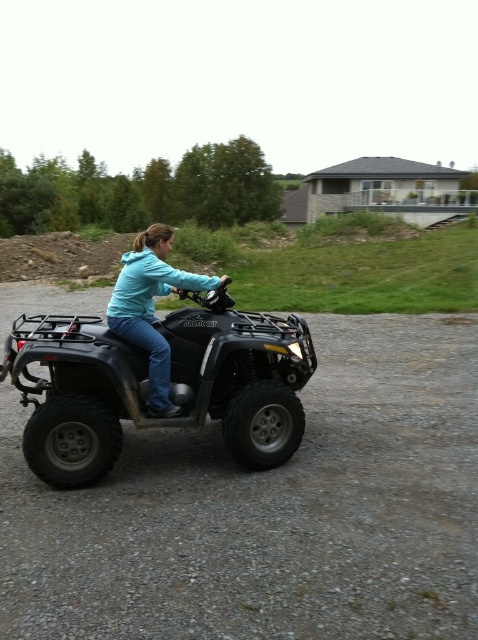
This screenshot has width=478, height=640. Find the location of `black rubber dirt track at center`. black rubber dirt track at center is located at coordinates (270, 509).

In the scene shown: Who is higher up, black rubber dirt track at center or matte black atv at center?

matte black atv at center is above.

Measure the distance between black rubber dirt track at center and camera.

A distance of 5.54 meters exists between black rubber dirt track at center and camera.

Where is `black rubber dirt track at center`? The image size is (478, 640). black rubber dirt track at center is located at coordinates (270, 509).

Which is behind, point (99, 428) or point (159, 332)?

Positioned behind is point (159, 332).

Which of these two, matte black atv at center or teal matte jacket at center, stands shorter?

With less height is matte black atv at center.

Does point (259, 435) come closer to viewer compared to point (170, 289)?

Yes, point (259, 435) is in front of point (170, 289).

The height and width of the screenshot is (640, 478). I want to click on matte black atv at center, so click(x=171, y=385).

Is point (397, 561) positioned after point (130, 259)?

No, (397, 561) is closer to viewer.

This screenshot has width=478, height=640. Identify the location of black rubber dirt track at center. (270, 509).

You are a GUI agent. You are given a task and a screenshot of the screen. Output one action in this format:
    pyautogui.click(x=<x>, y=<y>)
    Task: Click on the black rubber dirt track at center
    The height and width of the screenshot is (640, 478).
    Given the screenshot: What is the action you would take?
    [270, 509]